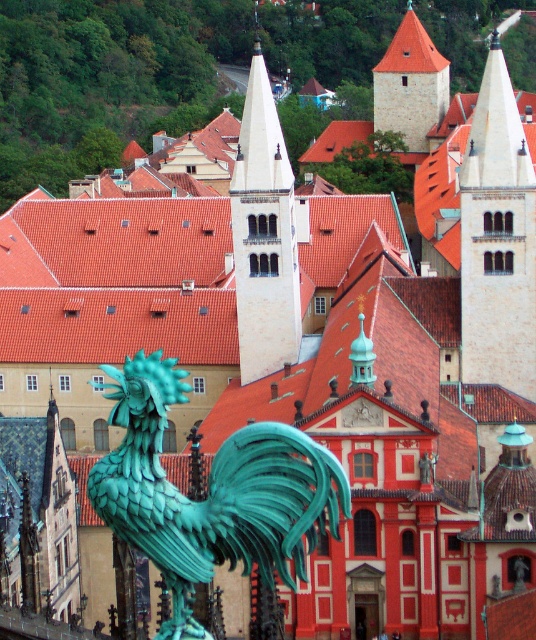
Question: Does smooth beige tower at center have a smaller size compared to brown stone tower at upper center?

Choices:
 (A) yes
 (B) no

Answer: (B)

Question: Does green patina rooster at center appear over brown stone tower at upper center?

Choices:
 (A) no
 (B) yes

Answer: (A)

Question: Estimate the real-world distances between objects in this image. Which object is closer to the smooth stone tower at upper right?

Choices:
 (A) brown stone tower at upper center
 (B) green patina rooster at center

Answer: (B)

Question: Does green patina rooster at center have a lesser width compared to smooth beige tower at center?

Choices:
 (A) no
 (B) yes

Answer: (A)

Question: Which of these objects is positioned farthest from the green patina rooster at center?

Choices:
 (A) smooth beige tower at center
 (B) smooth stone tower at upper right

Answer: (A)

Question: Which point is closer to the camera taking this photo?

Choices:
 (A) (402, 118)
 (B) (249, 296)
 (C) (510, 371)

Answer: (C)